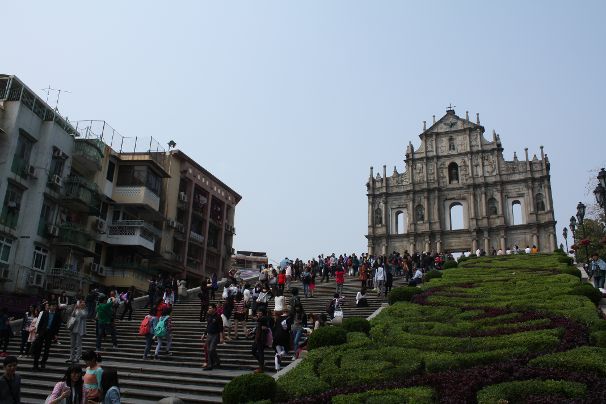
Locate an element on the screen. lamp is located at coordinates (577, 211), (598, 189).